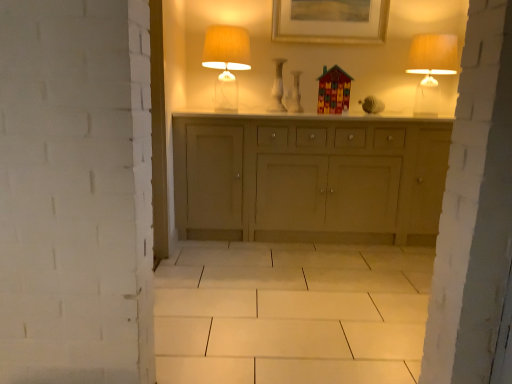
Question: Is translucent glass table lamp at upper center, marked as the 1th table lamp in a left-to-right arrangement, at the left side of white glossy vase at center?

Choices:
 (A) yes
 (B) no

Answer: (A)

Question: Is translucent glass table lamp at upper center, which is the second table lamp in right-to-left order, positioned with its back to white glossy vase at center?

Choices:
 (A) yes
 (B) no

Answer: (B)

Question: Considering the relative sizes of translucent glass table lamp at upper center, marked as the 1th table lamp in a left-to-right arrangement, and white glossy vase at center in the image provided, is translucent glass table lamp at upper center, marked as the 1th table lamp in a left-to-right arrangement, shorter than white glossy vase at center?

Choices:
 (A) yes
 (B) no

Answer: (B)

Question: From a real-world perspective, is translucent glass table lamp at upper center, which is the second table lamp in right-to-left order, positioned under white glossy vase at center based on gravity?

Choices:
 (A) no
 (B) yes

Answer: (A)

Question: Is translucent glass table lamp at upper center, which is the second table lamp in right-to-left order, smaller than white glossy vase at center?

Choices:
 (A) no
 (B) yes

Answer: (A)

Question: Looking at the image, does translucent glass table lamp at upper center, marked as the 1th table lamp in a left-to-right arrangement, seem bigger or smaller compared to white glossy vase at center?

Choices:
 (A) small
 (B) big

Answer: (B)

Question: Relative to white glossy vase at center, is translucent glass table lamp at upper center, which is the second table lamp in right-to-left order, in front or behind?

Choices:
 (A) behind
 (B) front

Answer: (B)

Question: In the image, is translucent glass table lamp at upper center, marked as the 1th table lamp in a left-to-right arrangement, on the left side or the right side of white glossy vase at center?

Choices:
 (A) left
 (B) right

Answer: (A)

Question: Is translucent glass table lamp at upper center, marked as the 1th table lamp in a left-to-right arrangement, situated inside white glossy vase at center or outside?

Choices:
 (A) outside
 (B) inside

Answer: (A)

Question: Would you say gold-framed picture at upper center is to the left or to the right of white glossy vase at center in the picture?

Choices:
 (A) right
 (B) left

Answer: (A)

Question: From their relative heights in the image, would you say gold-framed picture at upper center is taller or shorter than white glossy vase at center?

Choices:
 (A) tall
 (B) short

Answer: (B)

Question: Is gold-framed picture at upper center wider or thinner than white glossy vase at center?

Choices:
 (A) wide
 (B) thin

Answer: (B)

Question: Considering the positions of point (329, 3) and point (275, 64), is point (329, 3) closer or farther from the camera than point (275, 64)?

Choices:
 (A) closer
 (B) farther

Answer: (A)

Question: Choose the correct answer: Is white glossy vase at center inside translucent glass table lamp at upper center, which is the second table lamp in right-to-left order, or outside it?

Choices:
 (A) outside
 (B) inside

Answer: (A)

Question: From the image's perspective, is white glossy vase at center positioned above or below translucent glass table lamp at upper center, marked as the 1th table lamp in a left-to-right arrangement?

Choices:
 (A) above
 (B) below

Answer: (B)